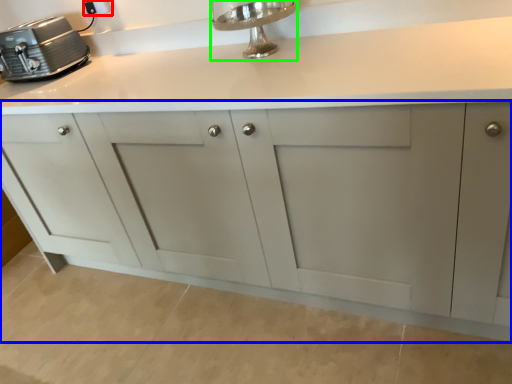
Question: Considering the real-world distances, which object is farthest from electric outlet (highlighted by a red box)? cabinetry (highlighted by a blue box) or faucet (highlighted by a green box)?

Choices:
 (A) cabinetry
 (B) faucet

Answer: (A)